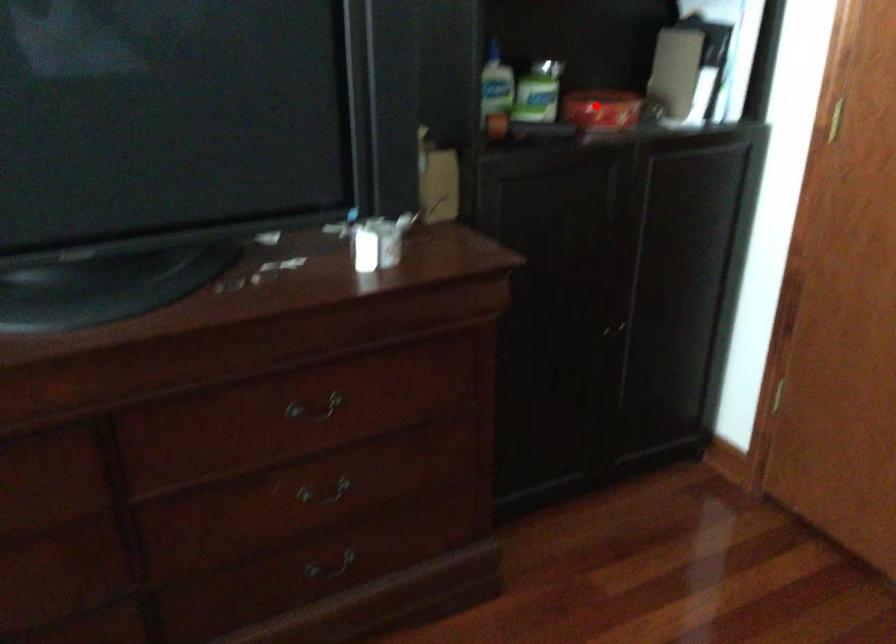
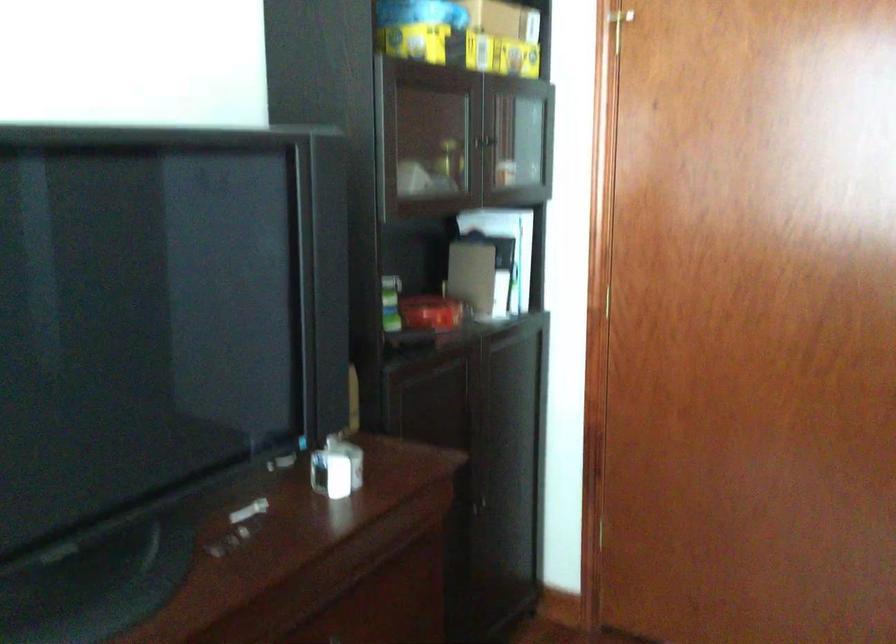
Question: I am providing you with two images of the same scene from different viewpoints. Image1 has a red point marked. In image2, the corresponding 3D location appears at what relative position? Reply with the corresponding letter.

Choices:
 (A) Closer
 (B) Farther

Answer: (B)